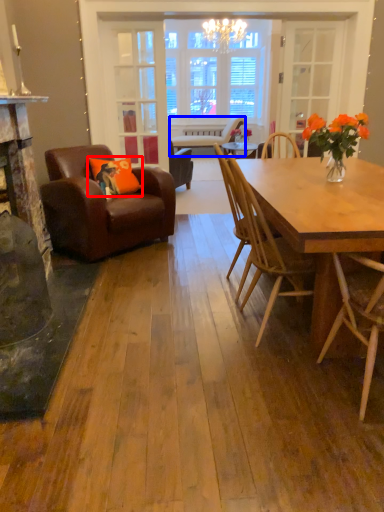
Question: Which object is closer to the camera taking this photo, pillow (highlighted by a red box) or chair (highlighted by a blue box)?

Choices:
 (A) pillow
 (B) chair

Answer: (A)